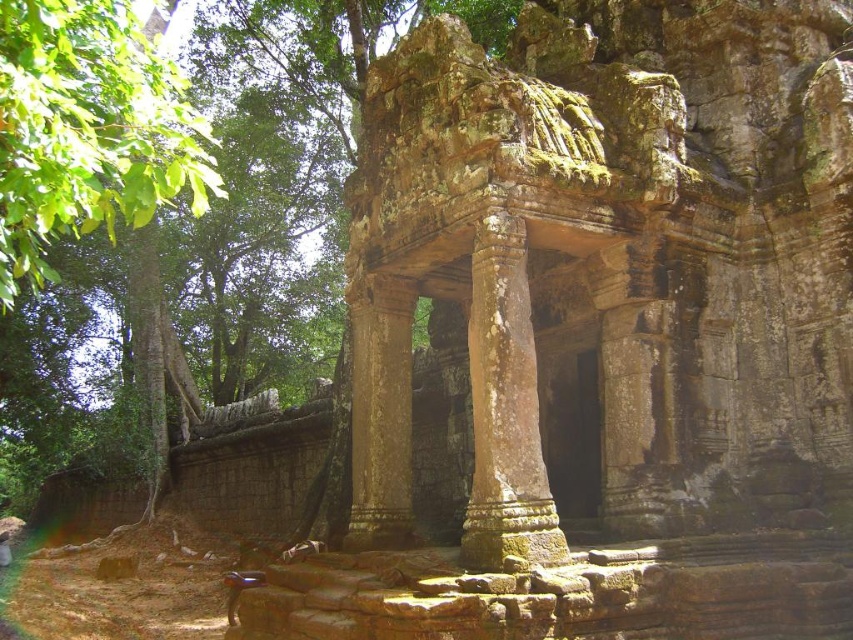
Which is below, brown stone temple at center or green leafy tree at left?

Positioned lower is brown stone temple at center.

From the picture: Is brown stone temple at center above green leafy tree at left?

Incorrect, brown stone temple at center is not positioned above green leafy tree at left.

Is point (416, 266) closer to camera compared to point (30, 52)?

No, it is not.

Locate an element on the screen. This screenshot has width=853, height=640. brown stone temple at center is located at coordinates (610, 256).

Does brown stone temple at center have a smaller size compared to rusty stone pillar at center?

Incorrect, brown stone temple at center is not smaller in size than rusty stone pillar at center.

Does brown stone temple at center have a larger size compared to rusty stone pillar at center?

Correct, brown stone temple at center is larger in size than rusty stone pillar at center.

Does point (717, 424) come in front of point (514, 314)?

No, it is behind (514, 314).

At what (x,y) coordinates should I click in order to perform the action: click on brown stone temple at center. Please return your answer as a coordinate pair (x, y). Looking at the image, I should click on (610, 256).

Is point (90, 38) farther from viewer compared to point (479, 291)?

That is False.

The image size is (853, 640). Describe the element at coordinates (88, 129) in the screenshot. I see `green leafy tree at left` at that location.

Locate an element on the screen. green leafy tree at left is located at coordinates (88, 129).